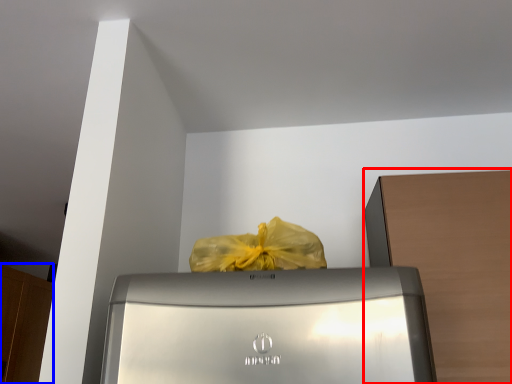
Question: Which of the following is the closest to the observer, cabinetry (highlighted by a red box) or cabinetry (highlighted by a blue box)?

Choices:
 (A) cabinetry
 (B) cabinetry

Answer: (A)